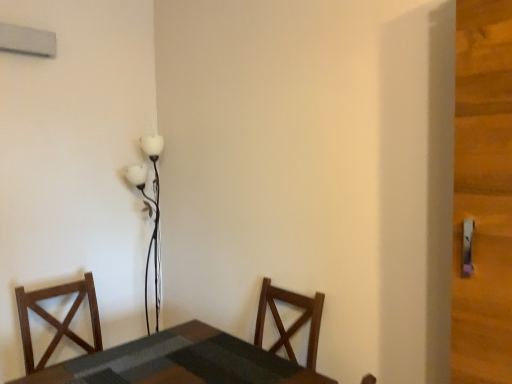
Question: Should I look upward or downward to see smooth dark wood table at lower left?

Choices:
 (A) down
 (B) up

Answer: (A)

Question: Can you confirm if dark wood chair at left is shorter than smooth dark wood table at lower left?

Choices:
 (A) yes
 (B) no

Answer: (B)

Question: Is dark wood chair at left looking in the opposite direction of smooth dark wood table at lower left?

Choices:
 (A) no
 (B) yes

Answer: (A)

Question: Does dark wood chair at left come in front of smooth dark wood table at lower left?

Choices:
 (A) yes
 (B) no

Answer: (B)

Question: From a real-world perspective, does dark wood chair at left sit lower than smooth dark wood table at lower left?

Choices:
 (A) no
 (B) yes

Answer: (A)

Question: Are dark wood chair at left and smooth dark wood table at lower left beside each other?

Choices:
 (A) no
 (B) yes

Answer: (A)

Question: Is smooth dark wood table at lower left surrounded by dark wood chair at left?

Choices:
 (A) yes
 (B) no

Answer: (B)

Question: From the image's perspective, is smooth dark wood table at lower left located above dark wood chair at left?

Choices:
 (A) yes
 (B) no

Answer: (B)

Question: Can you confirm if smooth dark wood table at lower left is taller than dark wood chair at left?

Choices:
 (A) no
 (B) yes

Answer: (A)

Question: Does smooth dark wood table at lower left have a smaller size compared to dark wood chair at left?

Choices:
 (A) no
 (B) yes

Answer: (A)

Question: Is smooth dark wood table at lower left thinner than dark wood chair at left?

Choices:
 (A) yes
 (B) no

Answer: (B)

Question: Does smooth dark wood table at lower left have a lesser height compared to dark wood chair at left?

Choices:
 (A) no
 (B) yes

Answer: (B)

Question: Would you say smooth dark wood table at lower left is outside dark wood chair at left?

Choices:
 (A) no
 (B) yes

Answer: (B)

Question: Is white glossy floor lamp at upper center surrounding smooth dark wood table at lower left?

Choices:
 (A) no
 (B) yes

Answer: (A)